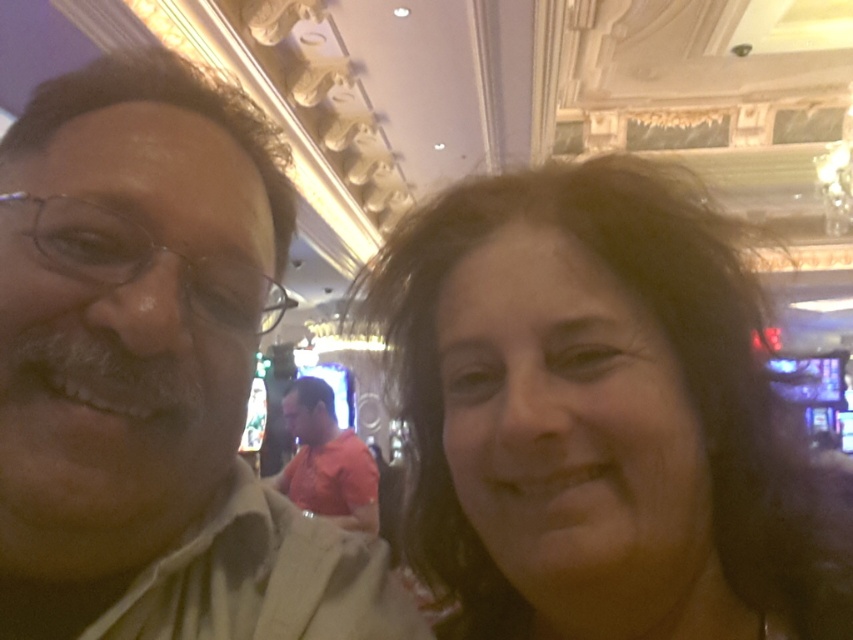
Question: Which object appears farthest from the camera in this image?

Choices:
 (A) matte beige shirt at left
 (B) orange cotton shirt at center

Answer: (B)

Question: Among these objects, which one is nearest to the camera?

Choices:
 (A) orange cotton shirt at center
 (B) dark brown hair at center

Answer: (B)

Question: Does dark brown hair at center appear over matte beige shirt at left?

Choices:
 (A) yes
 (B) no

Answer: (B)

Question: Where is dark brown hair at center located in relation to orange cotton shirt at center in the image?

Choices:
 (A) below
 (B) above

Answer: (B)

Question: Is matte beige shirt at left bigger than orange cotton shirt at center?

Choices:
 (A) no
 (B) yes

Answer: (A)

Question: Which point appears closest to the camera in this image?

Choices:
 (A) (35, 358)
 (B) (332, 440)

Answer: (A)